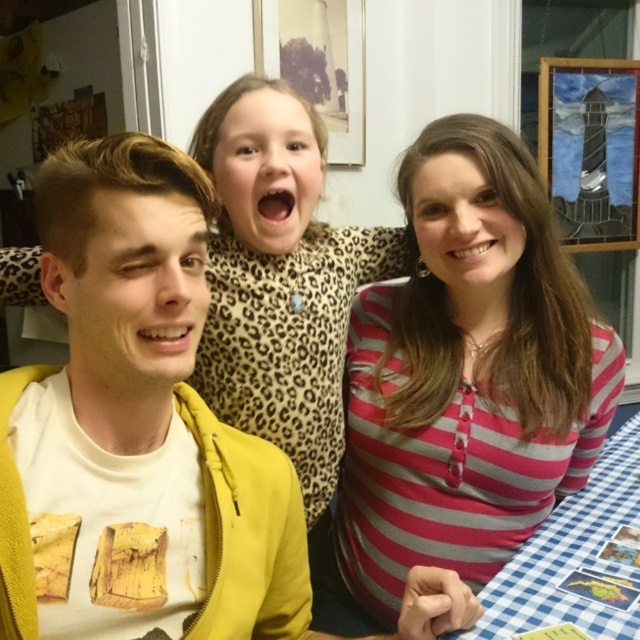
Question: Which point is closer to the camera?

Choices:
 (A) (433, 212)
 (B) (291, 236)
 (C) (170, 250)
 (D) (481, 621)

Answer: (C)

Question: Is yellow zip-up jacket at left above pink striped shirt at center?

Choices:
 (A) no
 (B) yes

Answer: (A)

Question: Which point is closer to the camera taking this photo?

Choices:
 (A) (609, 528)
 (B) (88, 544)
 (C) (550, 380)
 (D) (260, 160)

Answer: (B)

Question: Is pink striped shirt at center further to the viewer compared to blue checkered tablecloth at lower right?

Choices:
 (A) yes
 (B) no

Answer: (A)

Question: Based on their relative distances, which object is nearer to the pink striped shirt at center?

Choices:
 (A) yellow zip-up jacket at left
 (B) blue checkered tablecloth at lower right

Answer: (B)

Question: Is yellow zip-up jacket at left to the right of blue checkered tablecloth at lower right from the viewer's perspective?

Choices:
 (A) no
 (B) yes

Answer: (A)